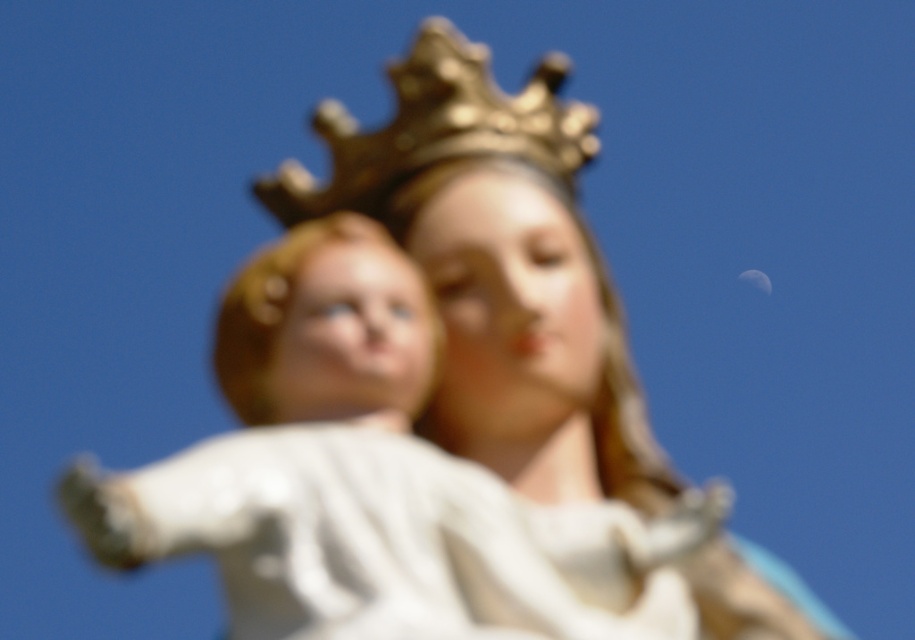
Does white porcelain child at center have a greater width compared to gold metallic crown at upper center?

Correct, the width of white porcelain child at center exceeds that of gold metallic crown at upper center.

Between white porcelain child at center and gold metallic crown at upper center, which one appears on the right side from the viewer's perspective?

From the viewer's perspective, gold metallic crown at upper center appears more on the right side.

What are the coordinates of `white porcelain child at center` in the screenshot? It's located at (371, 481).